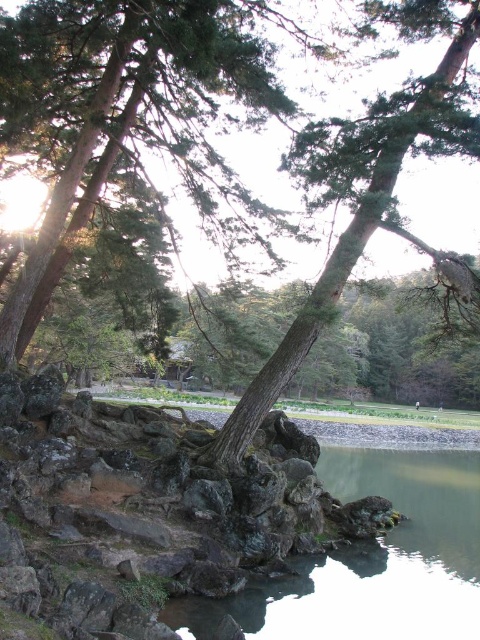
Between smooth gray water at lower center and smooth brown tree trunk at center, which one appears on the left side from the viewer's perspective?

Positioned to the left is smooth brown tree trunk at center.

The height and width of the screenshot is (640, 480). In order to click on smooth gray water at lower center in this screenshot , I will do `click(373, 561)`.